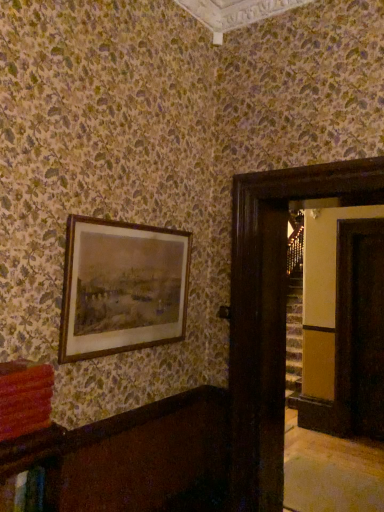
Question: From a real-world perspective, is brown wooden picture frame at upper left positioned above or below transparent glass door at right, arranged as the first glass door when viewed from the right?

Choices:
 (A) above
 (B) below

Answer: (A)

Question: From their relative heights in the image, would you say brown wooden picture frame at upper left is taller or shorter than transparent glass door at right, arranged as the first glass door when viewed from the right?

Choices:
 (A) short
 (B) tall

Answer: (A)

Question: Which of these objects is positioned farthest from the transparent glass door at right, the second glass door from the left?

Choices:
 (A) matte red book at lower left
 (B) dark wood door at right, placed as the first glass door when sorted from front to back
 (C) brown wooden picture frame at upper left

Answer: (A)

Question: Based on their relative distances, which object is nearer to the dark wood door at right, placed as the first glass door when sorted from front to back?

Choices:
 (A) brown wooden picture frame at upper left
 (B) transparent glass door at right, the second glass door when ordered from front to back
 (C) matte red book at lower left

Answer: (A)